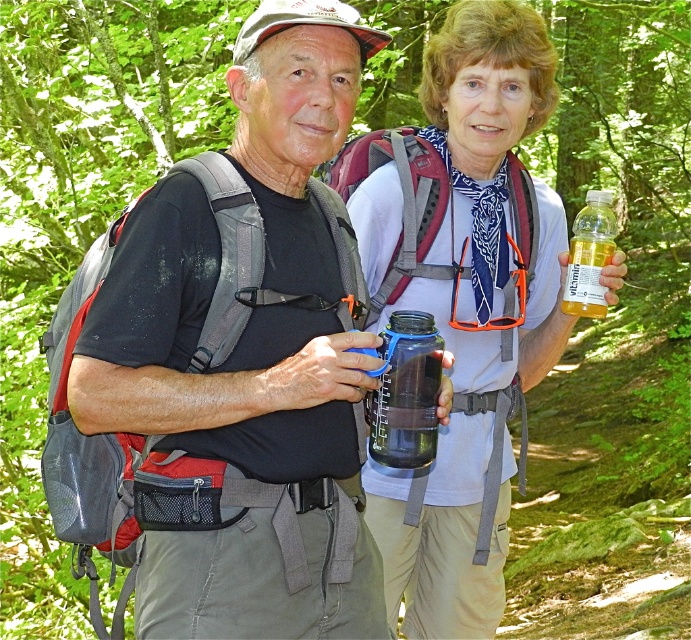
You are planning to pack for a hike and have both a transparent plastic water bottle at center and a translucent yellow bottle at center. If you want to choose the one that takes up more space horizontally in your backpack, which should you pick?

The transparent plastic water bottle at center might be wider than translucent yellow bottle at center, so it would take up more horizontal space in the backpack.

You are planning to pack your backpack for a hike and have both the transparent plastic water bottle at center and the translucent yellow bottle at center. Which one should you choose if you want to save space in your backpack?

The transparent plastic water bottle at center occupies less space than the translucent yellow bottle at center, so you should choose the transparent plastic water bottle at center to save space in your backpack.